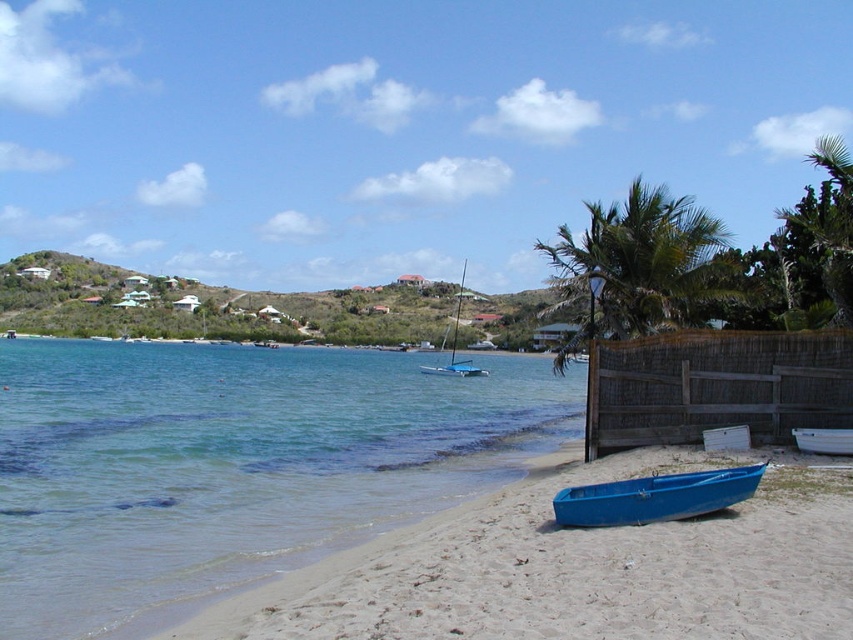
Who is lower down, clear blue water at lower left or green leafy palm tree at center-right?

clear blue water at lower left is below.

Who is higher up, clear blue water at lower left or green leafy palm tree at center-right?

Positioned higher is green leafy palm tree at center-right.

Between point (50, 595) and point (694, 257), which one is positioned in front?

Point (50, 595) is more forward.

Locate an element on the screen. Image resolution: width=853 pixels, height=640 pixels. clear blue water at lower left is located at coordinates (231, 465).

Is point (662, 509) less distant than point (840, 438)?

Yes.

Is blue plastic canoe at lower right closer to the viewer compared to white plastic boat at lower right?

Yes, blue plastic canoe at lower right is closer to the viewer.

Is point (691, 512) positioned after point (808, 440)?

No, it is in front of (808, 440).

What are the coordinates of `blue plastic canoe at lower right` in the screenshot? It's located at (654, 497).

Is clear blue water at lower left to the right of white plastic boat at lower right from the viewer's perspective?

No, clear blue water at lower left is not to the right of white plastic boat at lower right.

Does point (334, 385) come behind point (836, 452)?

That is True.

The width and height of the screenshot is (853, 640). I want to click on clear blue water at lower left, so click(231, 465).